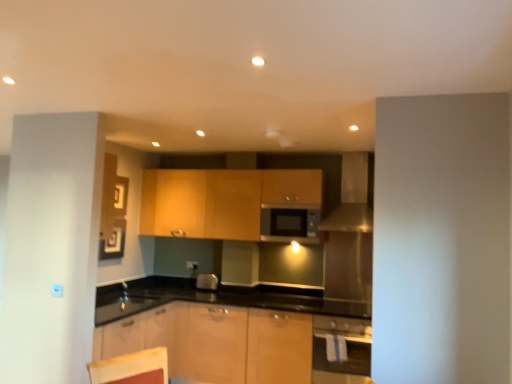
Question: Are white glossy oven at lower right and matte silver microwave at center beside each other?

Choices:
 (A) no
 (B) yes

Answer: (A)

Question: From the image's perspective, would you say white glossy oven at lower right is positioned over matte silver microwave at center?

Choices:
 (A) no
 (B) yes

Answer: (A)

Question: Can you confirm if white glossy oven at lower right is bigger than matte silver microwave at center?

Choices:
 (A) no
 (B) yes

Answer: (B)

Question: Does white glossy oven at lower right lie in front of matte silver microwave at center?

Choices:
 (A) yes
 (B) no

Answer: (A)

Question: Is white glossy oven at lower right positioned far away from matte silver microwave at center?

Choices:
 (A) yes
 (B) no

Answer: (A)

Question: Is satin silver exhaust hood at upper right taller or shorter than matte silver microwave at center?

Choices:
 (A) short
 (B) tall

Answer: (B)

Question: Is point (352, 220) closer or farther from the camera than point (314, 208)?

Choices:
 (A) closer
 (B) farther

Answer: (A)

Question: Considering the positions of satin silver exhaust hood at upper right and matte silver microwave at center in the image, is satin silver exhaust hood at upper right wider or thinner than matte silver microwave at center?

Choices:
 (A) wide
 (B) thin

Answer: (A)

Question: Is satin silver exhaust hood at upper right to the left or to the right of matte silver microwave at center in the image?

Choices:
 (A) left
 (B) right

Answer: (B)

Question: From the image's perspective, is satin silver exhaust hood at upper right located above or below matte wood cabinets at center?

Choices:
 (A) above
 (B) below

Answer: (A)

Question: Is point (347, 178) closer or farther from the camera than point (266, 175)?

Choices:
 (A) farther
 (B) closer

Answer: (B)

Question: Is satin silver exhaust hood at upper right inside the boundaries of matte wood cabinets at center, or outside?

Choices:
 (A) outside
 (B) inside

Answer: (A)

Question: In terms of height, does satin silver exhaust hood at upper right look taller or shorter compared to matte wood cabinets at center?

Choices:
 (A) short
 (B) tall

Answer: (B)

Question: From the image's perspective, is white glossy oven at lower right above or below matte wood cabinets at center?

Choices:
 (A) above
 (B) below

Answer: (B)

Question: Is white glossy oven at lower right taller or shorter than matte wood cabinets at center?

Choices:
 (A) tall
 (B) short

Answer: (B)